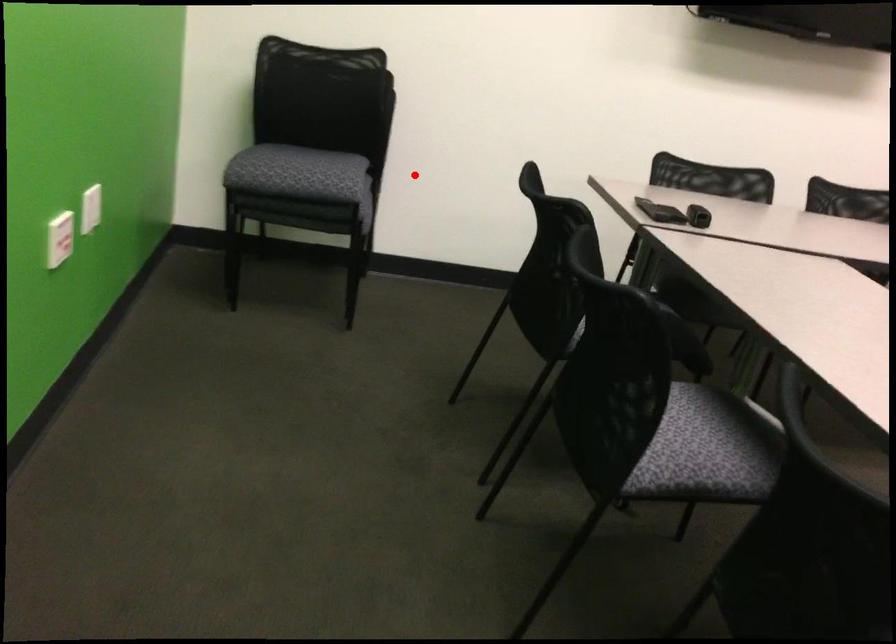
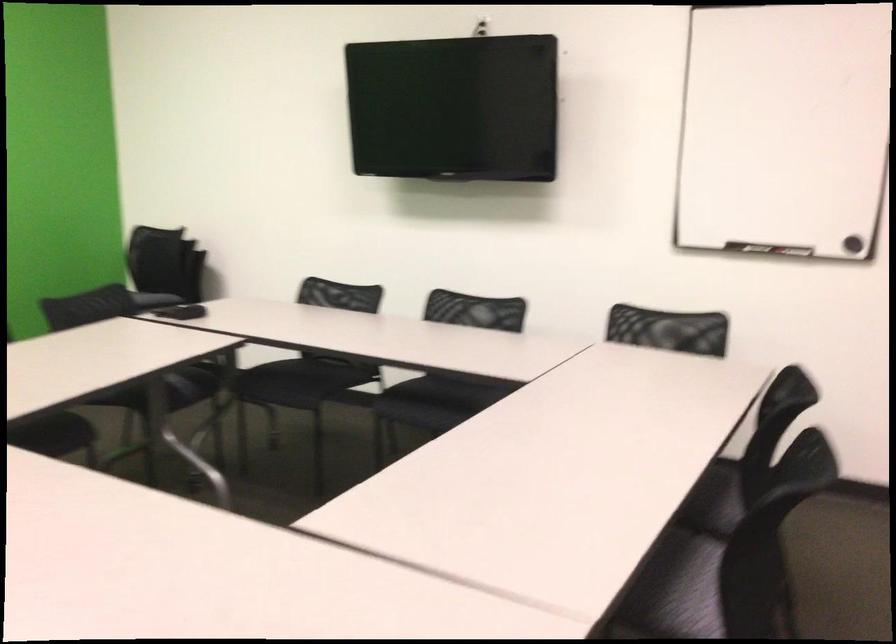
The point at the highlighted location is marked in the first image. Where is the corresponding point in the second image?

(181, 310)